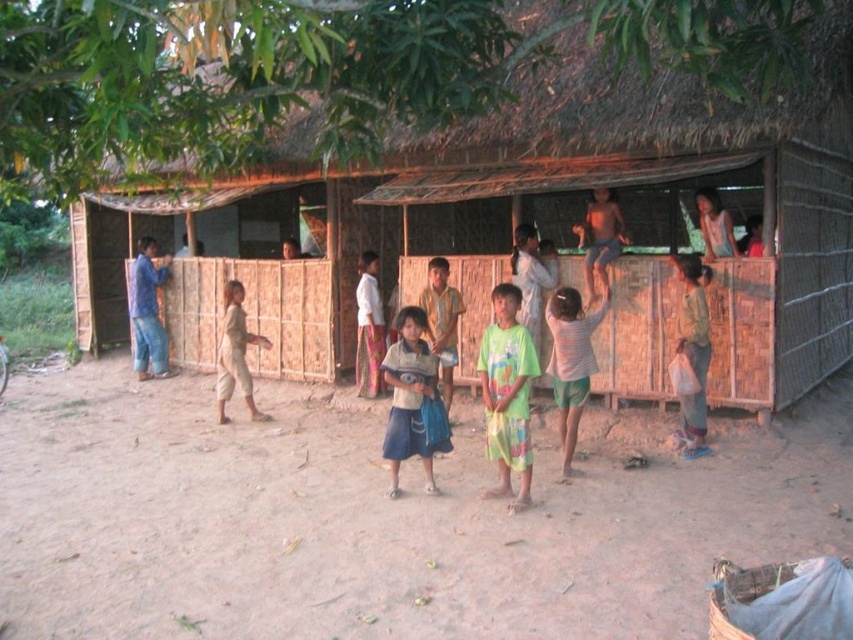
Question: Can you confirm if brown sandy ground at center is positioned to the right of light brown fabric bag at lower right?

Choices:
 (A) yes
 (B) no

Answer: (B)

Question: Which object is farther from the camera taking this photo?

Choices:
 (A) light brown woven cloth at center
 (B) light brown wooden pole at upper right

Answer: (B)

Question: Can you confirm if bamboo hut at center is positioned to the right of white cotton shirt at center?

Choices:
 (A) no
 (B) yes

Answer: (B)

Question: Where is blue jeans at left located in relation to bare skin/smooth body at upper center in the image?

Choices:
 (A) above
 (B) below

Answer: (B)

Question: Which point is closer to the camera?

Choices:
 (A) bare skin/smooth body at upper center
 (B) light brown wooden pole at upper right

Answer: (B)

Question: Which point is closer to the camera?

Choices:
 (A) (374, 289)
 (B) (155, 307)
 (C) (238, 364)
 (D) (421, 433)

Answer: (D)